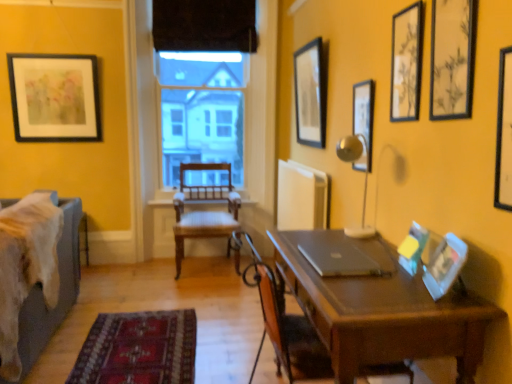
Where is `empty space that is in between matte plastic picture frame at right, which appears as the fifth picture frame when viewed from the left, and sleek silver laptop at center`? The width and height of the screenshot is (512, 384). empty space that is in between matte plastic picture frame at right, which appears as the fifth picture frame when viewed from the left, and sleek silver laptop at center is located at coordinates (389, 277).